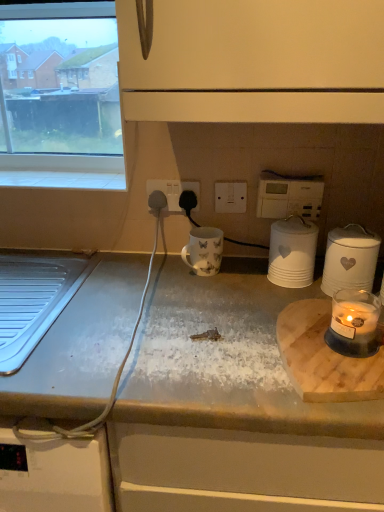
Identify the location of vacant area that is in front of white glossy mug at center. [x=203, y=304].